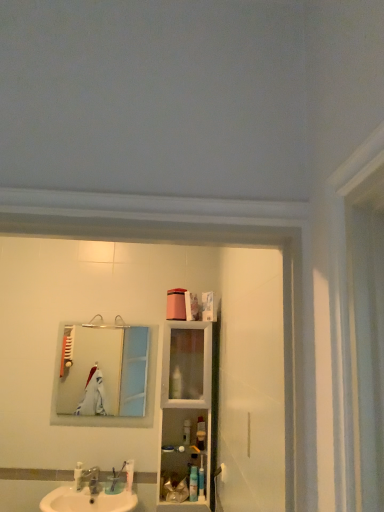
At what (x,y) coordinates should I click in order to perform the action: click on vacant area that is in front of white plastic toothbrush at lower left, which ranks as the 5th toiletry in right-to-left order. Please return your answer as a coordinate pair (x, y). This screenshot has width=384, height=512. Looking at the image, I should click on (74, 497).